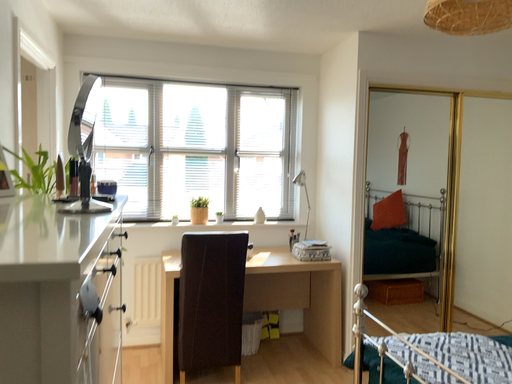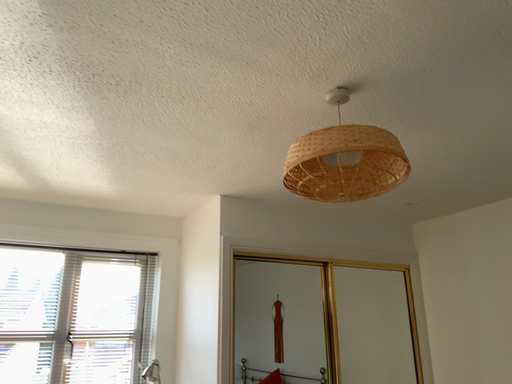
Question: Which way did the camera rotate in the video?

Choices:
 (A) rotated left
 (B) rotated right

Answer: (B)